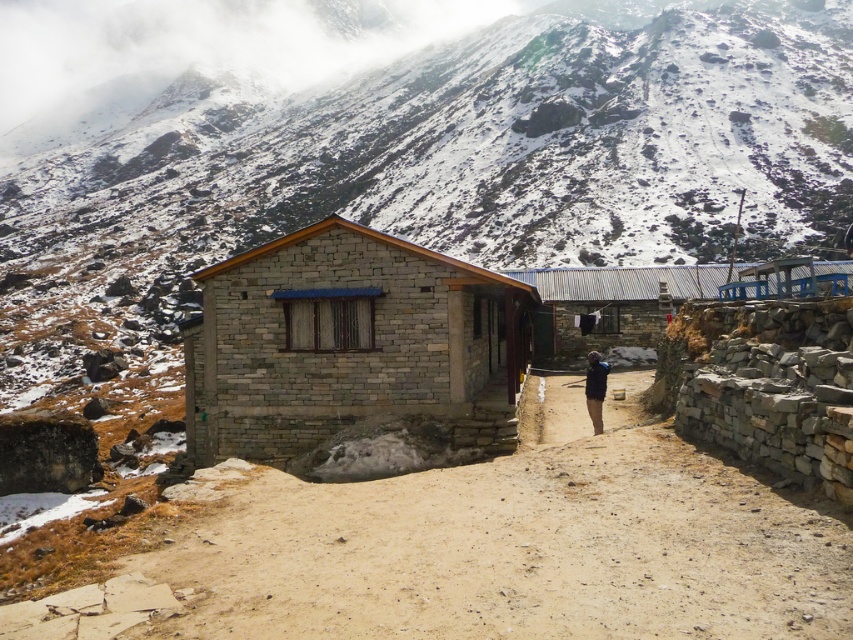
Is brown dirt track at center taller than brown dirt path at center?

Correct, brown dirt track at center is much taller as brown dirt path at center.

Is brown dirt track at center positioned in front of brown dirt path at center?

Yes, brown dirt track at center is closer to the viewer.

Is point (384, 579) positioned in front of point (543, 419)?

Yes, point (384, 579) is in front of point (543, 419).

The image size is (853, 640). I want to click on brown dirt track at center, so click(482, 554).

Does gray stone hut at center have a greater width compared to dark blue jacket at center?

Yes, gray stone hut at center is wider than dark blue jacket at center.

Does point (285, 310) come closer to viewer compared to point (595, 394)?

Yes.

Locate an element on the screen. The image size is (853, 640). gray stone hut at center is located at coordinates (350, 344).

Between brown dirt track at center and dark blue jacket at center, which one is positioned higher?

dark blue jacket at center is higher up.

Who is shorter, brown dirt track at center or dark blue jacket at center?

Standing shorter between the two is brown dirt track at center.

Is point (445, 524) closer to camera compared to point (607, 371)?

Yes.

Locate an element on the screen. brown dirt track at center is located at coordinates (482, 554).